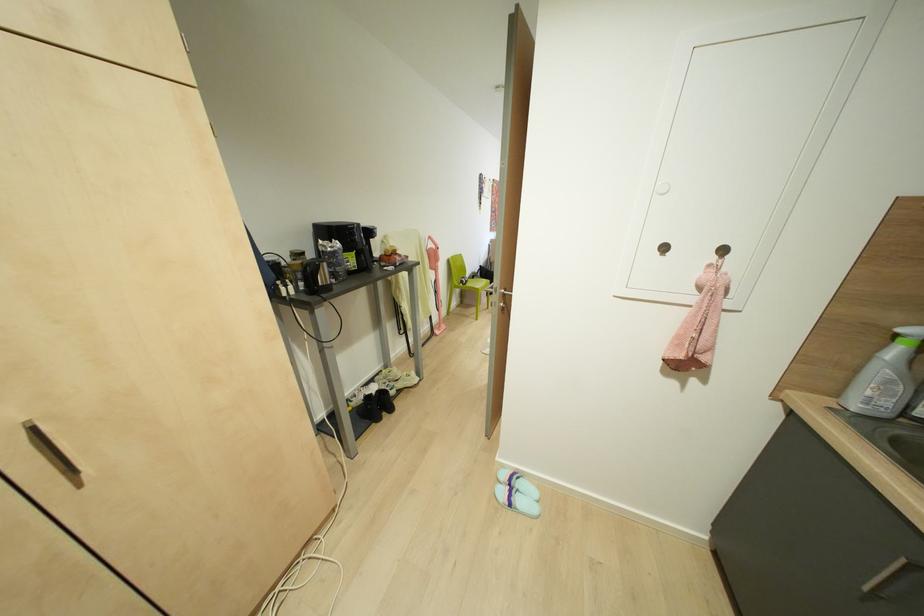
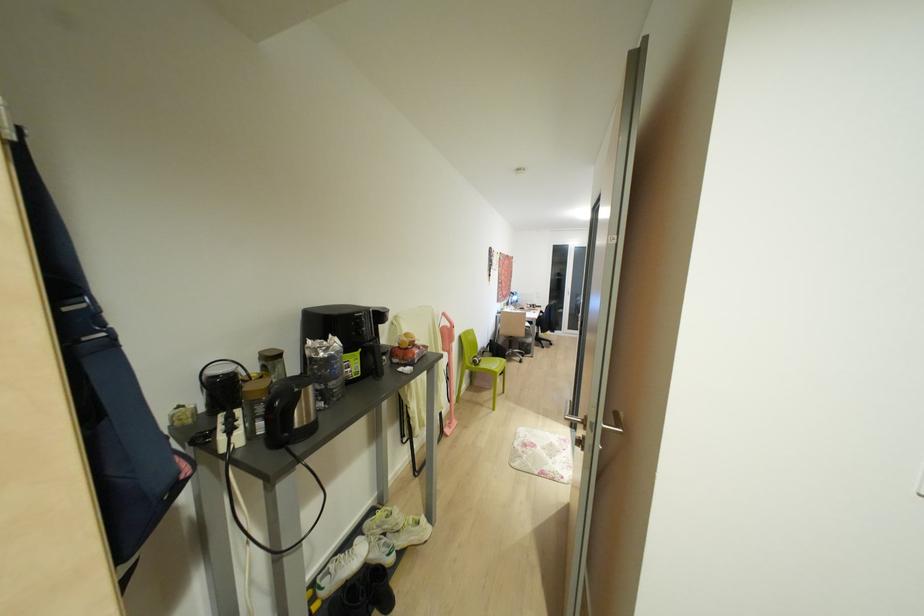
What movement of the cameraman would produce the second image?

The cameraman moved toward left, forward.